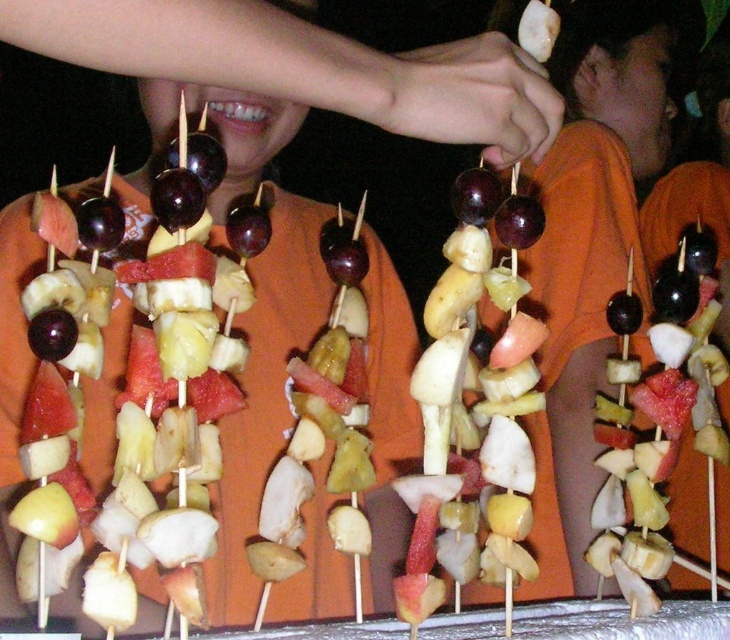
You are a photographer at the event and want to capture a closeup shot of the orange cotton shirt at center and the glossy wooden skewer with assorted fruits at center in the same frame. Your camera has a maximum focus range of 30 centimeters. Can both objects be in focus simultaneously?

The orange cotton shirt at center is 35.48 centimeters away from the glossy wooden skewer with assorted fruits at center. Since the distance between them exceeds the camera maximum focus range of 30 centimeters, both objects cannot be in focus simultaneously.

You are a food vendor at the event and need to arrange the glossy wooden skewer with assorted fruits at center and the shiny red watermelon at center so that they are exactly 6 inches apart. According to the image, is the current arrangement correct?

The distance between the glossy wooden skewer with assorted fruits at center and the shiny red watermelon at center is 6.02 inches, which is very close to 6 inches. The arrangement is correct as the slight difference is negligible for practical purposes.

In the scene shown: You are standing in front of the orange cotton shirt at center and want to grab the fruit skewer nearby. What is the minimum distance you need to move forward to reach the shirt?

The minimum distance you need to move forward to reach the orange cotton shirt at center is 37.27 inches.